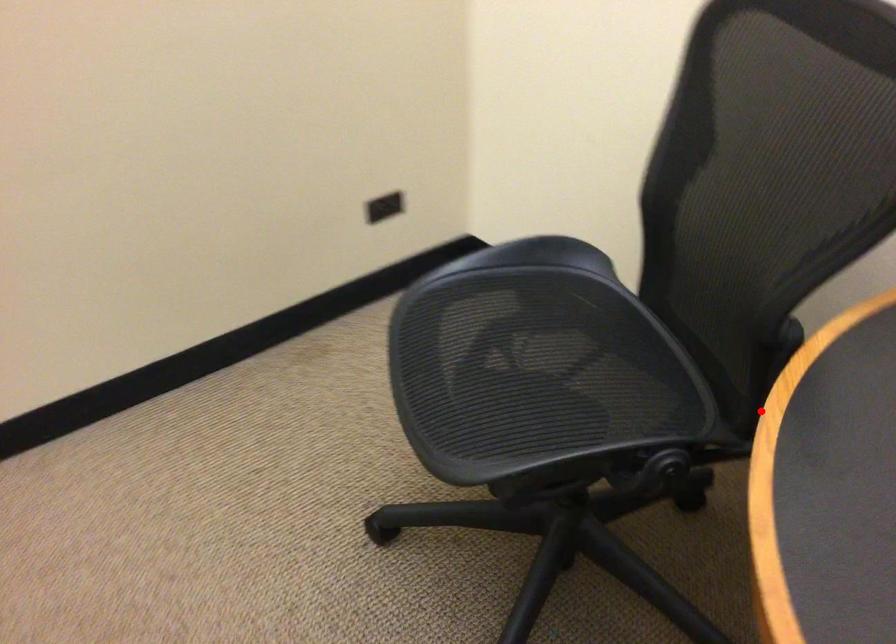
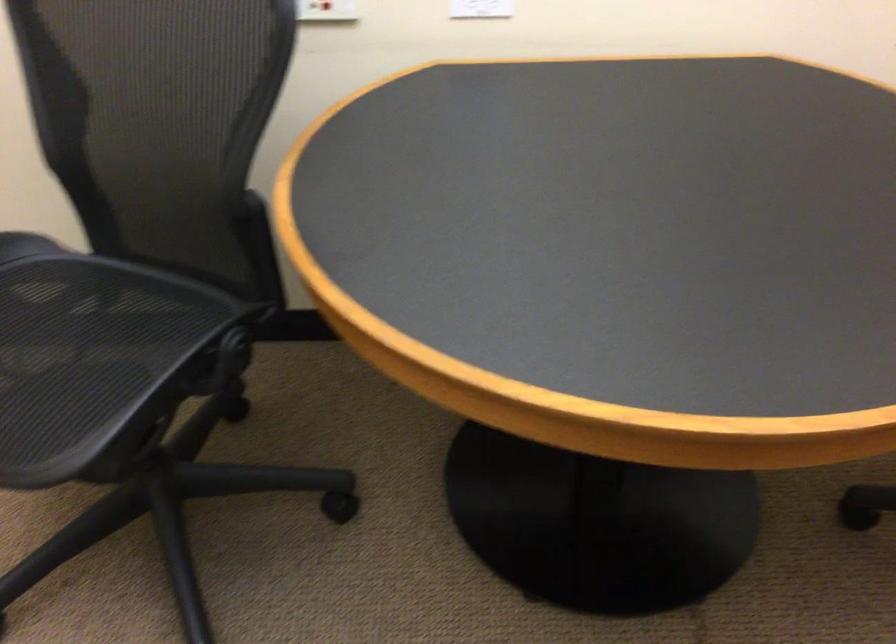
Question: I am providing you with two images of the same scene from different viewpoints. A red point is shown in image1. For the corresponding object point in image2, is it positioned nearer or farther from the camera?

Choices:
 (A) Nearer
 (B) Farther

Answer: (B)